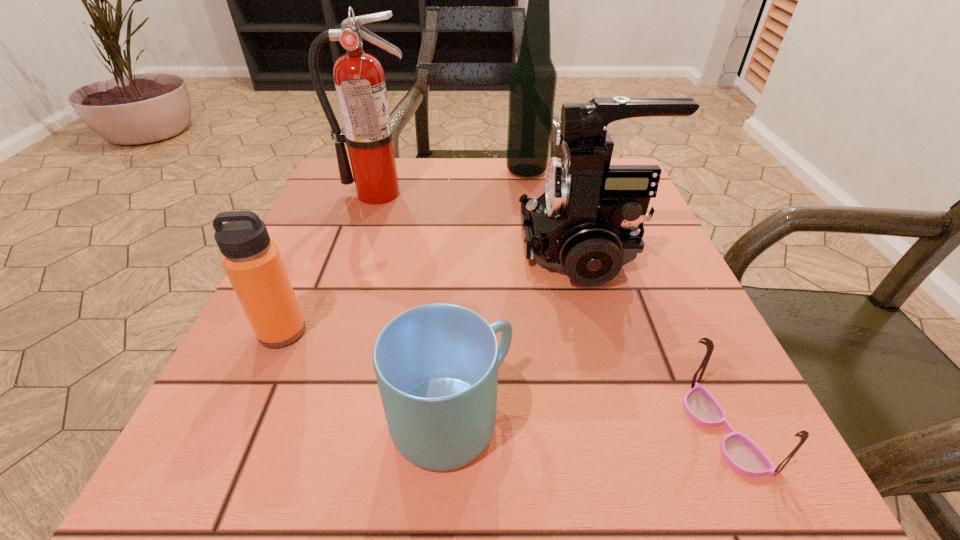
Where is `spectacles present at the near edge`? spectacles present at the near edge is located at coordinates (742, 454).

Locate an element on the screen. Image resolution: width=960 pixels, height=540 pixels. fire extinguisher positioned at the left edge is located at coordinates (359, 78).

You are a GUI agent. You are given a task and a screenshot of the screen. Output one action in this format:
    pyautogui.click(x=<x>, y=<y>)
    Task: Click on the thermos bottle that is at the left edge
    
    Given the screenshot: What is the action you would take?
    pyautogui.click(x=253, y=264)

Where is `camcorder at the right edge`? camcorder at the right edge is located at coordinates (585, 225).

Where is `spectacles situated at the right edge`? This screenshot has width=960, height=540. spectacles situated at the right edge is located at coordinates (742, 454).

Where is `object that is at the far left corner`? This screenshot has height=540, width=960. object that is at the far left corner is located at coordinates (359, 78).

Locate an element on the screen. The height and width of the screenshot is (540, 960). object that is positioned at the near right corner is located at coordinates (x=742, y=454).

Locate an element on the screen. free space at the far edge of the desktop is located at coordinates (463, 197).

Identify the location of free region at the near edge of the desktop. Image resolution: width=960 pixels, height=540 pixels. [537, 457].

Identify the location of free space at the left edge of the desktop. Image resolution: width=960 pixels, height=540 pixels. (300, 342).